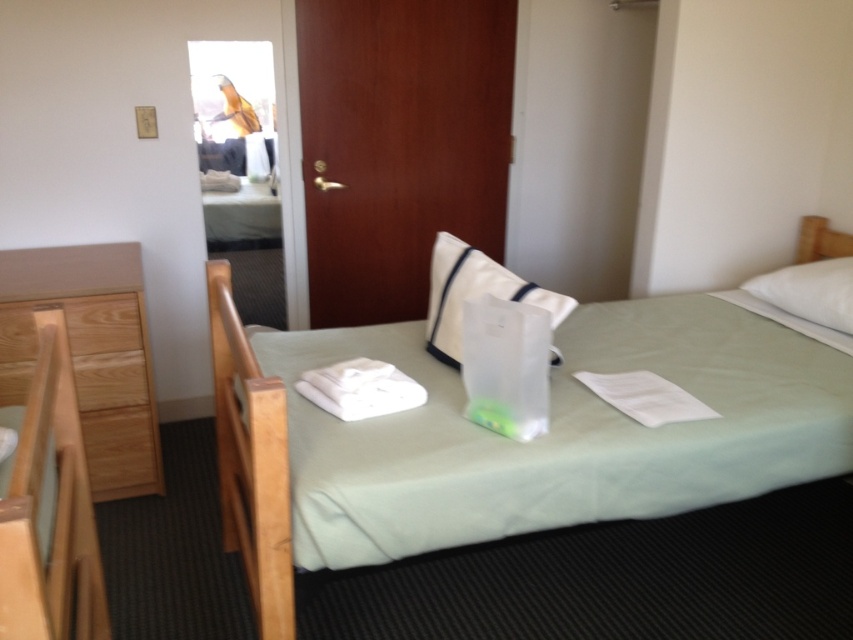
You are standing in the hotel room and want to place a small lamp on the light brown wood dresser at left. To reach it, you must walk around the white fabric pillow at center. Which direction should you move to first?

The light brown wood dresser at left is further to the viewer than the white fabric pillow at center, so you should move forward to go around the white fabric pillow at center and reach the light brown wood dresser at left.

You are standing in the hotel room and want to place a small item on the floor. There are two points marked in the room. The first point is at coordinate point(x=260, y=499) and the second is at point(x=778, y=275). According to the image, which point is closer to you?

Point(x=260, y=499) is in front of point(x=778, y=275), so it is closer to you.

You are a guest in a hotel room and need to place a small book on the bed. Which object, the green fabric bed at center or the white fabric pillow at center, has enough space to accommodate the book without it falling off?

The green fabric bed at center is larger in size than the white fabric pillow at center, so placing the book on the green fabric bed at center would provide more stable space to prevent it from falling off.